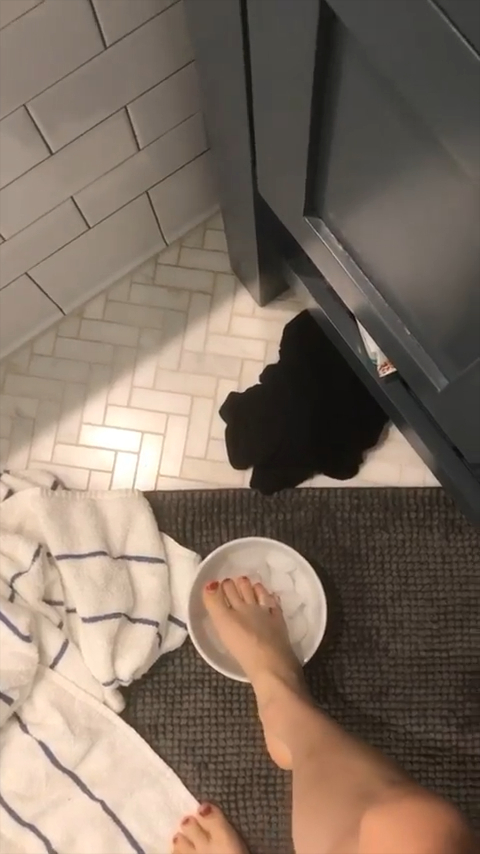
I want to click on bathmat, so click(398, 594).